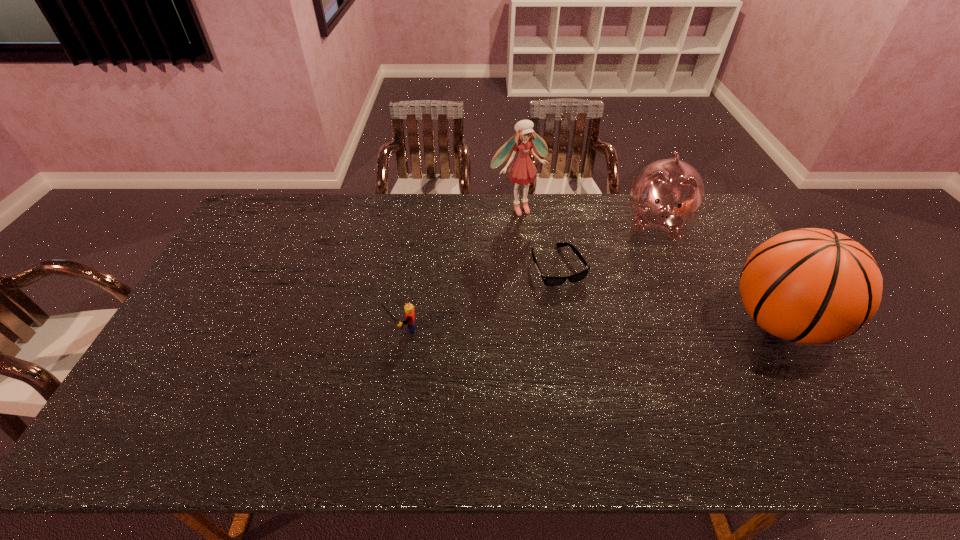
Find the location of a particular element. vacant space located 0.350m on the front-facing side of the sunglasses is located at coordinates (623, 384).

Image resolution: width=960 pixels, height=540 pixels. What are the coordinates of `free region located on the front-facing side of the sunglasses` in the screenshot? It's located at pyautogui.click(x=600, y=344).

I want to click on vacant space located on the front-facing side of the sunglasses, so click(x=609, y=359).

I want to click on free space located on the front-facing side of the doll, so click(x=555, y=248).

The image size is (960, 540). I want to click on blank space located 0.330m on the front-facing side of the doll, so click(x=577, y=275).

Where is `vacant space situated on the front-facing side of the doll`? vacant space situated on the front-facing side of the doll is located at coordinates (543, 234).

You are a GUI agent. You are given a task and a screenshot of the screen. Output one action in this format:
    pyautogui.click(x=<x>, y=<y>)
    Task: Click on the vacant space located on the front facing side of the third shortest object
    
    Given the screenshot: What is the action you would take?
    pyautogui.click(x=646, y=330)

Where is `vacant space located on the front facing side of the third shortest object`? vacant space located on the front facing side of the third shortest object is located at coordinates (649, 310).

The width and height of the screenshot is (960, 540). Identify the location of vacant space located on the front facing side of the third shortest object. (649, 310).

The width and height of the screenshot is (960, 540). I want to click on doll that is at the far edge, so click(522, 171).